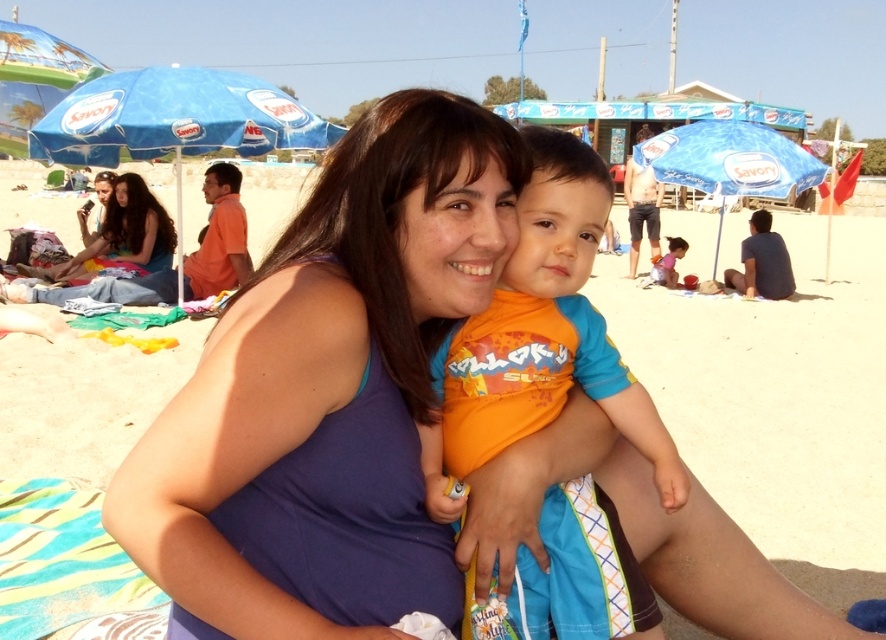
You are a beach vendor who needs to pack two orange shirts. You have a small bag that can only hold items narrower than 30 cm. The orange fabric shirt at center and the orange cotton shirt at lower center are both available. Which shirt can fit into your bag?

The orange fabric shirt at center has a width less than the orange cotton shirt at lower center. Since the bag can only hold items narrower than 30 cm, the orange fabric shirt at center may fit if its width is under 30 cm, but the orange cotton shirt at lower center is wider and definitely won

You are standing at the camera position and want to pick up an object located at point (561, 372). Can you reach it without moving your feet?

The point (561, 372) is 1.62 meters away from the camera. Since the average human arm length is about 0.7 meters, you cannot reach it without moving your feet.

You are a photographer taking a picture of the beach scene. You notice the orange fabric shirt at center and the long brown hair at lower left in your frame. Which object should you adjust your camera to focus on if you want to capture the one that is lower in the image?

The orange fabric shirt at center is below long brown hair at lower left, so you should focus on the orange fabric shirt at center to capture the lower object.